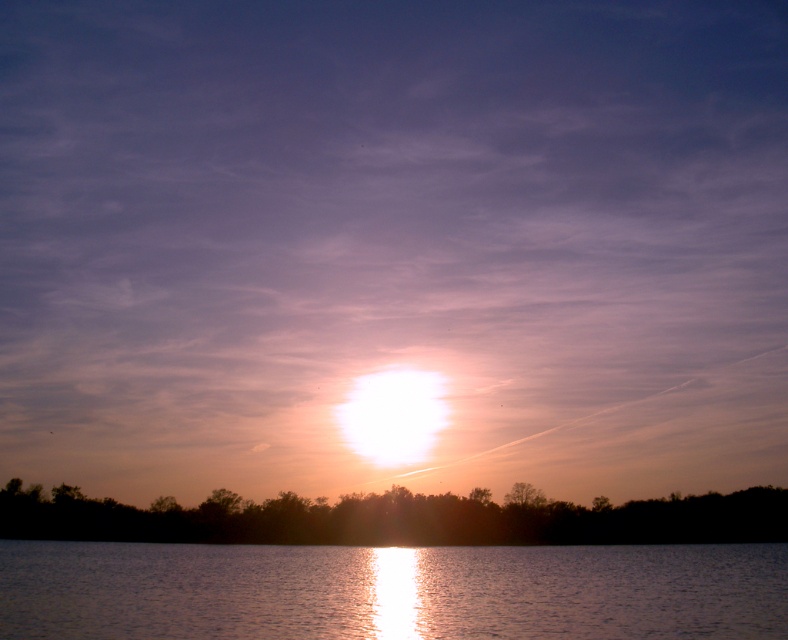
Who is positioned more to the left, glistening water at center or silky water at lower center?

Positioned to the left is silky water at lower center.

Does glistening water at center have a lesser height compared to silky water at lower center?

No.

Find the location of a particular element. The width and height of the screenshot is (788, 640). glistening water at center is located at coordinates (389, 592).

Locate an element on the screen. This screenshot has height=640, width=788. glistening water at center is located at coordinates (389, 592).